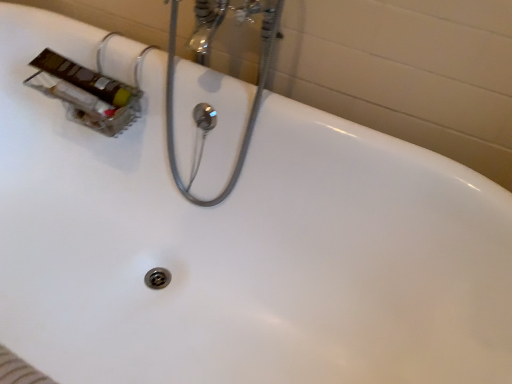
Where is `satin nickel faucet at upper left`? Image resolution: width=512 pixels, height=384 pixels. satin nickel faucet at upper left is located at coordinates (248, 120).

This screenshot has width=512, height=384. What do you see at coordinates (248, 120) in the screenshot?
I see `satin nickel faucet at upper left` at bounding box center [248, 120].

I want to click on satin nickel faucet at upper left, so click(x=248, y=120).